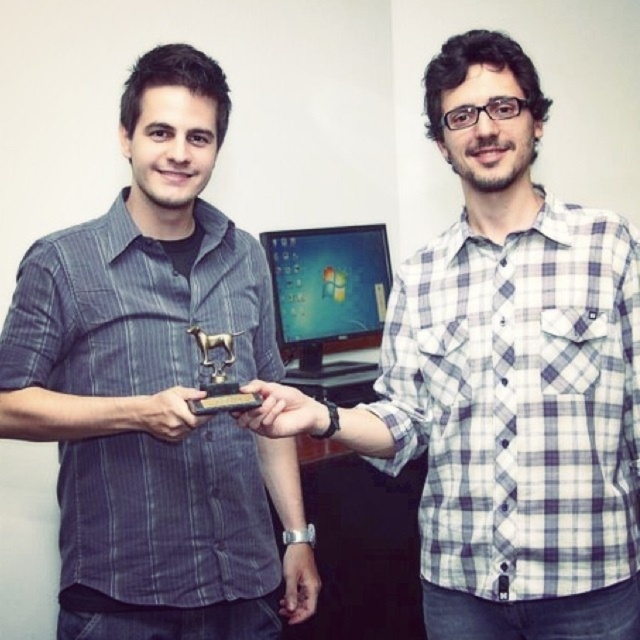
You are a delivery robot that is 0.5 meters wide. You are in the office scene and need to deliver a package to the matte black phone at center. Can you move directly towards the phone without hitting any obstacles?

The distance of matte black phone at center from camera is 1.11 meters, so yes, the robot can move directly towards the phone without hitting any obstacles since the distance is sufficient for navigation.

You are standing in an office and see the point at coordinates (108, 440). If you want to place a 1.2 meter long banner horizontally from your current position to that point, will it fit exactly without overlapping?

The distance between you and the point at coordinates (108, 440) is 1.25 meters. Since the banner is 1.2 meters long, it will fit with a small gap of 0.05 meters remaining.

You are a delivery robot with a package that needs to be placed between the white checkered shirt at center and the matte plastic monitor at center. The package is 3 feet long. Can you fit the package between them?

The distance between the white checkered shirt at center and the matte plastic monitor at center is 3.76 feet. Since the package is 3 feet long, it can fit between them as there is enough space.